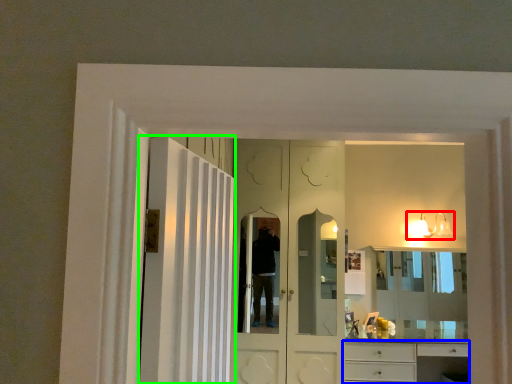
Question: Which object is the closest to the light fixture (highlighted by a red box)? Choose among these: cabinetry (highlighted by a blue box) or door (highlighted by a green box).

Choices:
 (A) cabinetry
 (B) door

Answer: (A)